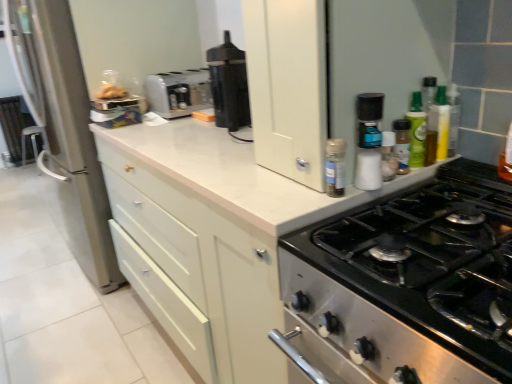
Question: Considering the positions of white plastic salt shaker at upper right, the second bottle from the left, and white plastic salt shaker at upper right, the 4th bottle when ordered from right to left, in the image, is white plastic salt shaker at upper right, the second bottle from the left, wider or thinner than white plastic salt shaker at upper right, the 4th bottle when ordered from right to left,?

Choices:
 (A) thin
 (B) wide

Answer: (A)

Question: Is white plastic salt shaker at upper right, positioned as the 3th bottle in right-to-left order, inside or outside of white plastic salt shaker at upper right, the 4th bottle when ordered from right to left?

Choices:
 (A) outside
 (B) inside

Answer: (A)

Question: Which object is the closest to the white plastic salt shaker at upper right, the 4th bottle when ordered from right to left?

Choices:
 (A) white plastic toaster at center
 (B) green glass bottle at upper right, acting as the 1th bottle starting from the right
 (C) black plastic coffee maker at center
 (D) translucent plastic spice jar at upper right, arranged as the 3th bottle when viewed from the left
 (E) white plastic salt shaker at upper right, positioned as the 3th bottle in right-to-left order

Answer: (E)

Question: Based on their relative distances, which object is farther from the white plastic salt shaker at upper right, the second bottle from the left?

Choices:
 (A) matte silver refrigerator at left
 (B) white plastic spice rack at upper right
 (C) white plastic toaster at center
 (D) white plastic salt shaker at upper right, marked as the 1th bottle in a left-to-right arrangement
 (E) white matte cabinet at upper center

Answer: (A)